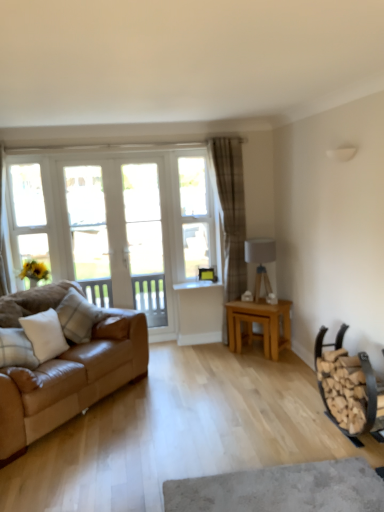
Question: Are light brown wooden table at center and white painted wood window frame at left located far from each other?

Choices:
 (A) yes
 (B) no

Answer: (A)

Question: Is light brown wooden table at center placed right next to white painted wood window frame at left?

Choices:
 (A) yes
 (B) no

Answer: (B)

Question: Considering the relative sizes of light brown wooden table at center and white painted wood window frame at left in the image provided, is light brown wooden table at center wider than white painted wood window frame at left?

Choices:
 (A) no
 (B) yes

Answer: (B)

Question: From a real-world perspective, is light brown wooden table at center located higher than white painted wood window frame at left?

Choices:
 (A) yes
 (B) no

Answer: (B)

Question: Is light brown wooden table at center closer to camera compared to white painted wood window frame at left?

Choices:
 (A) yes
 (B) no

Answer: (A)

Question: Does light brown wooden table at center appear on the right side of white painted wood window frame at left?

Choices:
 (A) yes
 (B) no

Answer: (A)

Question: Is clear glass screen door at center, which is the second screen door in left-to-right order, inside white glossy screen door at left, the second screen door when ordered from right to left?

Choices:
 (A) yes
 (B) no

Answer: (A)

Question: Considering the relative positions of white glossy screen door at left, the 1th screen door in the left-to-right sequence, and clear glass screen door at center, which is the 1th screen door in right-to-left order, in the image provided, is white glossy screen door at left, the 1th screen door in the left-to-right sequence, to the right of clear glass screen door at center, which is the 1th screen door in right-to-left order, from the viewer's perspective?

Choices:
 (A) no
 (B) yes

Answer: (A)

Question: From a real-world perspective, is white glossy screen door at left, the second screen door when ordered from right to left, positioned under clear glass screen door at center, which is the second screen door in left-to-right order, based on gravity?

Choices:
 (A) no
 (B) yes

Answer: (B)

Question: From the image's perspective, is white glossy screen door at left, the 1th screen door in the left-to-right sequence, below clear glass screen door at center, which is the second screen door in left-to-right order?

Choices:
 (A) no
 (B) yes

Answer: (B)

Question: Can you confirm if white glossy screen door at left, the second screen door when ordered from right to left, is taller than clear glass screen door at center, which is the 1th screen door in right-to-left order?

Choices:
 (A) yes
 (B) no

Answer: (A)

Question: Could you tell me if white glossy screen door at left, the second screen door when ordered from right to left, is turned towards clear glass screen door at center, which is the 1th screen door in right-to-left order?

Choices:
 (A) yes
 (B) no

Answer: (A)

Question: Does white painted wood window frame at left have a greater height compared to clear glass window at center?

Choices:
 (A) yes
 (B) no

Answer: (B)